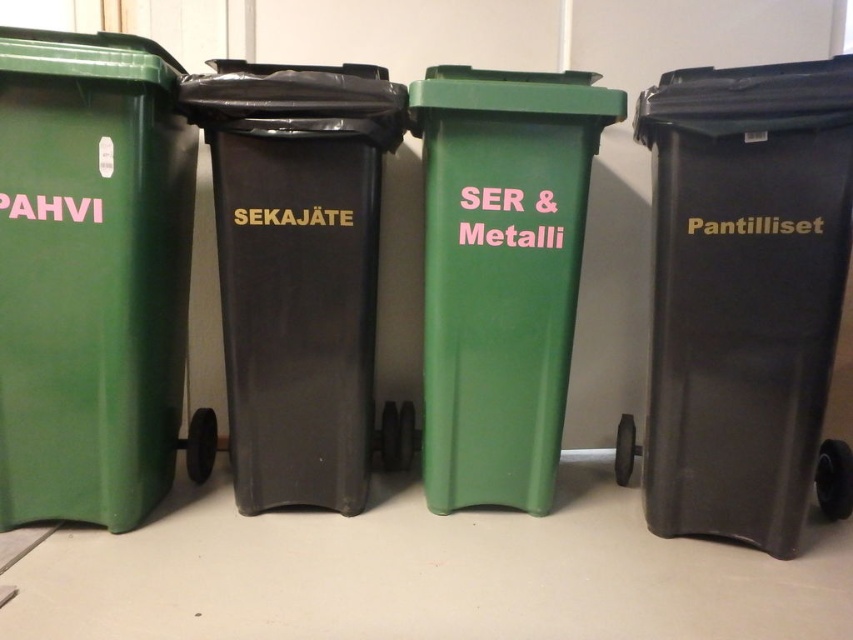
Is black plastic recycling bin at right smaller than black plastic bin at center?

Actually, black plastic recycling bin at right might be larger than black plastic bin at center.

Between black plastic recycling bin at right and black plastic bin at center, which one appears on the right side from the viewer's perspective?

black plastic recycling bin at right is more to the right.

Is point (718, 317) farther from camera compared to point (305, 97)?

That is True.

This screenshot has width=853, height=640. I want to click on black plastic recycling bin at right, so click(744, 298).

Who is positioned more to the left, black plastic recycling bin at right or green matte recycling bin at center?

green matte recycling bin at center

Does point (711, 458) come behind point (509, 76)?

Yes, point (711, 458) is behind point (509, 76).

I want to click on black plastic recycling bin at right, so click(744, 298).

At what (x,y) coordinates should I click in order to perform the action: click on black plastic recycling bin at right. Please return your answer as a coordinate pair (x, y). This screenshot has width=853, height=640. Looking at the image, I should click on [x=744, y=298].

Between green plastic pahvi at left and green matte recycling bin at center, which one has less height?

With less height is green matte recycling bin at center.

Is green plastic pahvi at left to the right of green matte recycling bin at center from the viewer's perspective?

In fact, green plastic pahvi at left is to the left of green matte recycling bin at center.

This screenshot has width=853, height=640. In order to click on green plastic pahvi at left in this screenshot , I will do `click(93, 278)`.

This screenshot has width=853, height=640. Identify the location of green plastic pahvi at left. (93, 278).